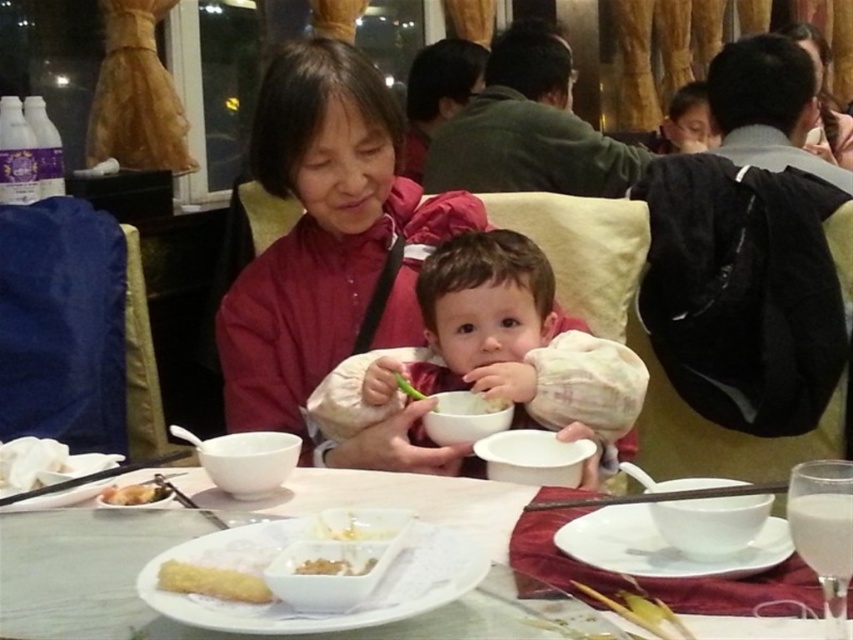
You are a guest at this restaurant and want to reach both the golden fried pastry at lower left and the crumbly yellow bread at center from your seat. Which item would you need to reach higher above the table to get?

The golden fried pastry at lower left is taller than the crumbly yellow bread at center, so you would need to reach higher to get the golden fried pastry at lower left.

You are a food critic visiting this restaurant and see the golden fried pastry at lower left and the crumbly yellow bread at center. Which one is wider?

The golden fried pastry at lower left is wider than the crumbly yellow bread at center according to the description.

You are standing at the entrance of the restaurant and want to take a photo of the point at coordinates point (192,451). If your camera has a focal length of 50mm and you need to focus at a distance of 5.27 feet to capture that point clearly, what is the minimum distance you should be from the table to ensure the point is in focus?

The point at coordinates point (192,451) is 5.27 feet away from the viewer. To ensure the point is in focus, you should position yourself at least 5.27 feet away from the table.